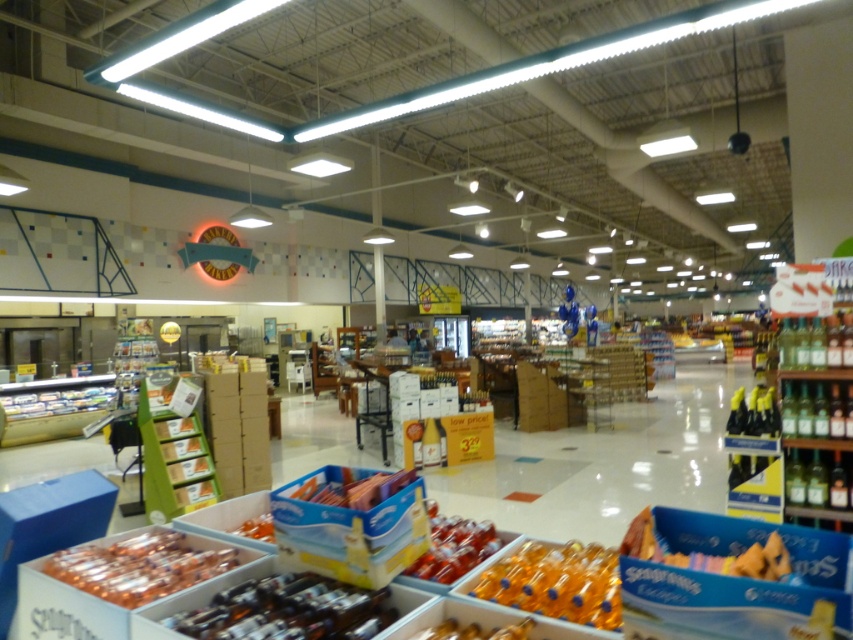
You are a store employee who needs to restock the shelves. You have a cart with both the translucent plastic bottles at center and the smooth plastic candy at center. The shelf you are restocking is only 12 inches wide. Can you fit both items on the shelf without overlapping?

The translucent plastic bottles at center and smooth plastic candy at center are 13.67 inches apart, so they cannot be placed on a 12 inch wide shelf without overlapping. You will need to find a wider shelf or place them separately.

You are a customer in the grocery store and want to grab both the translucent plastic bottles at center and the smooth plastic candy at center. Which one should you reach for first to avoid knocking over the other?

You should reach for the translucent plastic bottles at center first since it is in front of the smooth plastic candy at center, making it easier to access without disturbing the items behind.

You are a customer trying to grab both the blue cardboard box at center and the smooth plastic candy at center from the grocery store shelf. Can you reach both items at the same time with your two hands without moving your position?

The blue cardboard box at center and smooth plastic candy at center are 4.05 inches apart, so yes, you can reach both items at the same time with your two hands without moving your position since the distance between them is within comfortable reach.